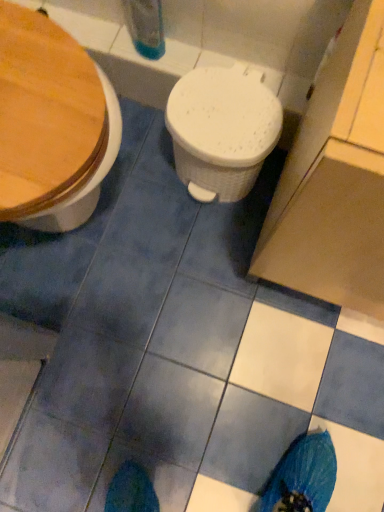
The width and height of the screenshot is (384, 512). I want to click on wooden at left, positioned as the 1th toilet in left-to-right order, so click(x=51, y=124).

Image resolution: width=384 pixels, height=512 pixels. What do you see at coordinates (51, 124) in the screenshot?
I see `wooden at left, positioned as the 1th toilet in left-to-right order` at bounding box center [51, 124].

What is the approximate height of wooden at left, which appears as the second toilet when viewed from the right?

28.26 inches.

Identify the location of white textured plastic at center, placed as the first toilet when sorted from right to left. The image size is (384, 512). (221, 131).

What do you see at coordinates (221, 131) in the screenshot? I see `white textured plastic at center, which ranks as the 2th toilet in left-to-right order` at bounding box center [221, 131].

What is the approximate height of white textured plastic at center, placed as the first toilet when sorted from right to left?

The height of white textured plastic at center, placed as the first toilet when sorted from right to left, is 10.60 inches.

You are a GUI agent. You are given a task and a screenshot of the screen. Output one action in this format:
    pyautogui.click(x=<x>, y=<y>)
    Task: Click on the wooden at left, which appears as the second toilet when viewed from the right
    The image size is (384, 512).
    Given the screenshot: What is the action you would take?
    (51, 124)

Is white textured plastic at center, placed as the first toilet when sorted from right to left, at the right side of wooden at left, positioned as the 1th toilet in left-to-right order?

Yes.

Which object is more forward, white textured plastic at center, which ranks as the 2th toilet in left-to-right order, or wooden at left, which appears as the second toilet when viewed from the right?

wooden at left, which appears as the second toilet when viewed from the right, is closer to the camera.

Considering the positions of point (199, 73) and point (74, 51), is point (199, 73) closer or farther from the camera than point (74, 51)?

Point (199, 73) appears to be farther away from the viewer than point (74, 51).

From the image's perspective, would you say white textured plastic at center, placed as the first toilet when sorted from right to left, is shown under wooden at left, positioned as the 1th toilet in left-to-right order?

Actually, white textured plastic at center, placed as the first toilet when sorted from right to left, appears above wooden at left, positioned as the 1th toilet in left-to-right order, in the image.

From a real-world perspective, between white textured plastic at center, placed as the first toilet when sorted from right to left, and wooden at left, positioned as the 1th toilet in left-to-right order, who is vertically lower?

white textured plastic at center, placed as the first toilet when sorted from right to left, from a real-world perspective.

Between white textured plastic at center, placed as the first toilet when sorted from right to left, and wooden at left, which appears as the second toilet when viewed from the right, which one has larger width?

wooden at left, which appears as the second toilet when viewed from the right.

Considering the sizes of white textured plastic at center, which ranks as the 2th toilet in left-to-right order, and wooden at left, which appears as the second toilet when viewed from the right, in the image, is white textured plastic at center, which ranks as the 2th toilet in left-to-right order, taller or shorter than wooden at left, which appears as the second toilet when viewed from the right,?

In the image, white textured plastic at center, which ranks as the 2th toilet in left-to-right order, appears to be shorter than wooden at left, which appears as the second toilet when viewed from the right.

Is white textured plastic at center, placed as the first toilet when sorted from right to left, bigger or smaller than wooden at left, which appears as the second toilet when viewed from the right?

Clearly, white textured plastic at center, placed as the first toilet when sorted from right to left, is smaller in size than wooden at left, which appears as the second toilet when viewed from the right.

Do you think white textured plastic at center, placed as the first toilet when sorted from right to left, is within wooden at left, positioned as the 1th toilet in left-to-right order, or outside of it?

white textured plastic at center, placed as the first toilet when sorted from right to left, is spatially situated outside wooden at left, positioned as the 1th toilet in left-to-right order.

Does white textured plastic at center, placed as the first toilet when sorted from right to left, touch wooden at left, positioned as the 1th toilet in left-to-right order?

No.

Could you tell me if white textured plastic at center, placed as the first toilet when sorted from right to left, is facing wooden at left, positioned as the 1th toilet in left-to-right order?

No, white textured plastic at center, placed as the first toilet when sorted from right to left, is not aimed at wooden at left, positioned as the 1th toilet in left-to-right order.

How different are the orientations of white textured plastic at center, placed as the first toilet when sorted from right to left, and wooden at left, which appears as the second toilet when viewed from the right, in degrees?

white textured plastic at center, placed as the first toilet when sorted from right to left, and wooden at left, which appears as the second toilet when viewed from the right, are facing 90 degrees away from each other.

What are the coordinates of `toilet on the right of wooden at left, which appears as the second toilet when viewed from the right` in the screenshot? It's located at (221, 131).

Considering the positions of objects wooden at left, positioned as the 1th toilet in left-to-right order, and white textured plastic at center, placed as the first toilet when sorted from right to left, in the image provided, who is more to the right, wooden at left, positioned as the 1th toilet in left-to-right order, or white textured plastic at center, placed as the first toilet when sorted from right to left,?

white textured plastic at center, placed as the first toilet when sorted from right to left.

In the scene shown: Relative to white textured plastic at center, which ranks as the 2th toilet in left-to-right order, is wooden at left, which appears as the second toilet when viewed from the right, in front or behind?

In the image, wooden at left, which appears as the second toilet when viewed from the right, appears in front of white textured plastic at center, which ranks as the 2th toilet in left-to-right order.

Is point (13, 212) more distant than point (245, 87)?

No.

From the image's perspective, is wooden at left, positioned as the 1th toilet in left-to-right order, above or below white textured plastic at center, which ranks as the 2th toilet in left-to-right order?

Clearly, from the image's perspective, wooden at left, positioned as the 1th toilet in left-to-right order, is below white textured plastic at center, which ranks as the 2th toilet in left-to-right order.

From a real-world perspective, is wooden at left, positioned as the 1th toilet in left-to-right order, beneath white textured plastic at center, which ranks as the 2th toilet in left-to-right order?

No, from a real-world perspective, wooden at left, positioned as the 1th toilet in left-to-right order, is not beneath white textured plastic at center, which ranks as the 2th toilet in left-to-right order.

Considering the sizes of objects wooden at left, positioned as the 1th toilet in left-to-right order, and white textured plastic at center, placed as the first toilet when sorted from right to left, in the image provided, who is wider, wooden at left, positioned as the 1th toilet in left-to-right order, or white textured plastic at center, placed as the first toilet when sorted from right to left,?

wooden at left, positioned as the 1th toilet in left-to-right order.

Is wooden at left, which appears as the second toilet when viewed from the right, taller or shorter than white textured plastic at center, which ranks as the 2th toilet in left-to-right order?

wooden at left, which appears as the second toilet when viewed from the right, is taller than white textured plastic at center, which ranks as the 2th toilet in left-to-right order.

Consider the image. Does wooden at left, which appears as the second toilet when viewed from the right, have a smaller size compared to white textured plastic at center, placed as the first toilet when sorted from right to left?

Actually, wooden at left, which appears as the second toilet when viewed from the right, might be larger than white textured plastic at center, placed as the first toilet when sorted from right to left.

Is white textured plastic at center, placed as the first toilet when sorted from right to left, completely or partially inside wooden at left, positioned as the 1th toilet in left-to-right order?

No, white textured plastic at center, placed as the first toilet when sorted from right to left, is not a part of wooden at left, positioned as the 1th toilet in left-to-right order.

Would you consider wooden at left, which appears as the second toilet when viewed from the right, to be distant from white textured plastic at center, placed as the first toilet when sorted from right to left?

They are positioned close to each other.

Is wooden at left, which appears as the second toilet when viewed from the right, oriented towards white textured plastic at center, placed as the first toilet when sorted from right to left?

Yes, wooden at left, which appears as the second toilet when viewed from the right, is facing white textured plastic at center, placed as the first toilet when sorted from right to left.

Based on the photo, measure the distance between wooden at left, positioned as the 1th toilet in left-to-right order, and white textured plastic at center, placed as the first toilet when sorted from right to left.

→ wooden at left, positioned as the 1th toilet in left-to-right order, is 10.79 inches from white textured plastic at center, placed as the first toilet when sorted from right to left.

In order to click on toilet located above the white textured plastic at center, which ranks as the 2th toilet in left-to-right order (from a real-world perspective) in this screenshot , I will do `click(51, 124)`.

In the image, there is a wooden at left, which appears as the second toilet when viewed from the right. Where is `toilet below it (from a real-world perspective)`? Image resolution: width=384 pixels, height=512 pixels. toilet below it (from a real-world perspective) is located at coordinates tap(221, 131).

Where is `toilet above the white textured plastic at center, which ranks as the 2th toilet in left-to-right order (from a real-world perspective)`? Image resolution: width=384 pixels, height=512 pixels. toilet above the white textured plastic at center, which ranks as the 2th toilet in left-to-right order (from a real-world perspective) is located at coordinates (51, 124).